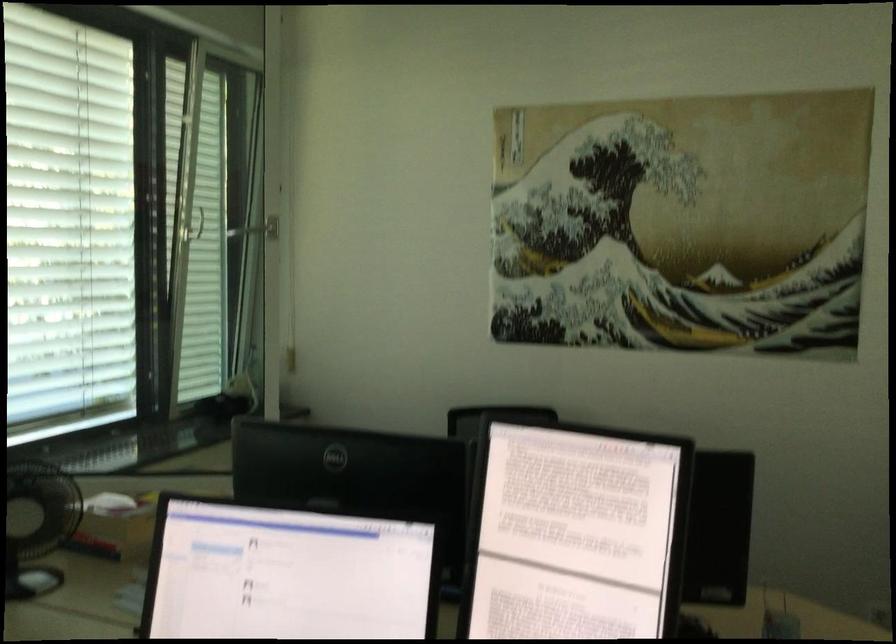
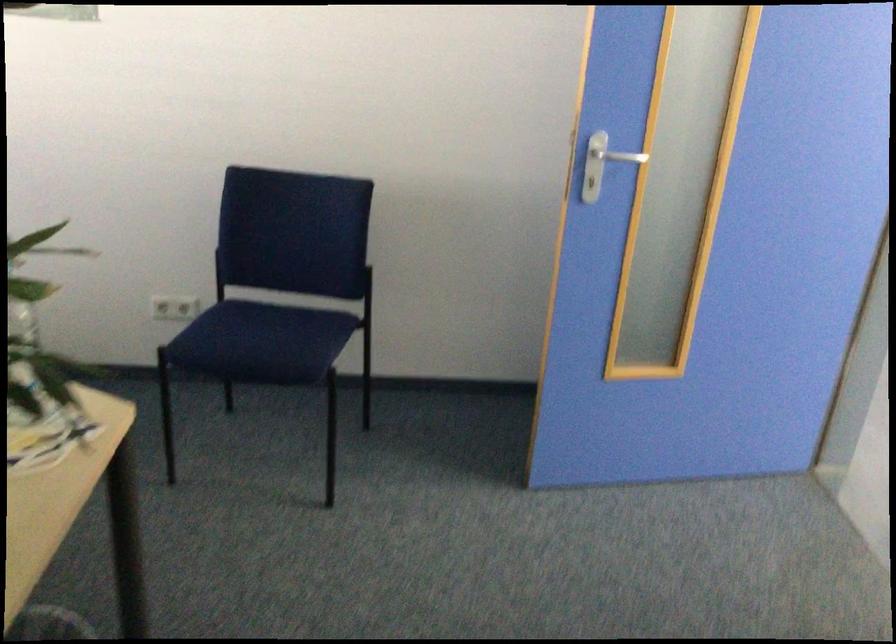
Question: Which direction would the cameraman need to move to produce the second image? Reply with the corresponding letter.

Choices:
 (A) Left
 (B) Right
 (C) Forward
 (D) Backward

Answer: (B)